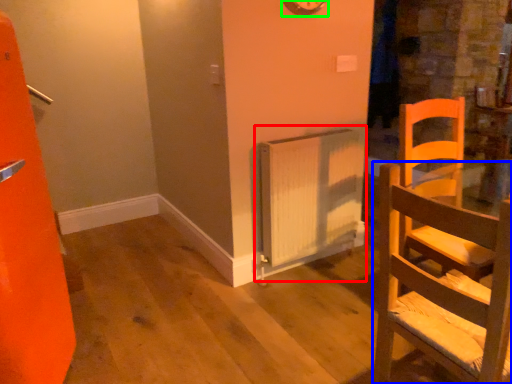
Question: Which object is the closest to the radiator (highlighted by a red box)? Choose among these: chair (highlighted by a blue box) or clock (highlighted by a green box).

Choices:
 (A) chair
 (B) clock

Answer: (B)